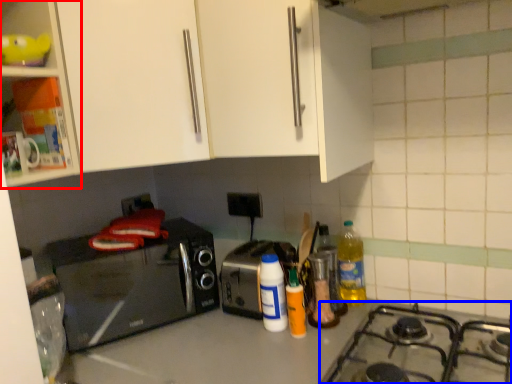
Question: Which of the following is the farthest to the observer, cabinetry (highlighted by a red box) or gas stove (highlighted by a blue box)?

Choices:
 (A) cabinetry
 (B) gas stove

Answer: (A)